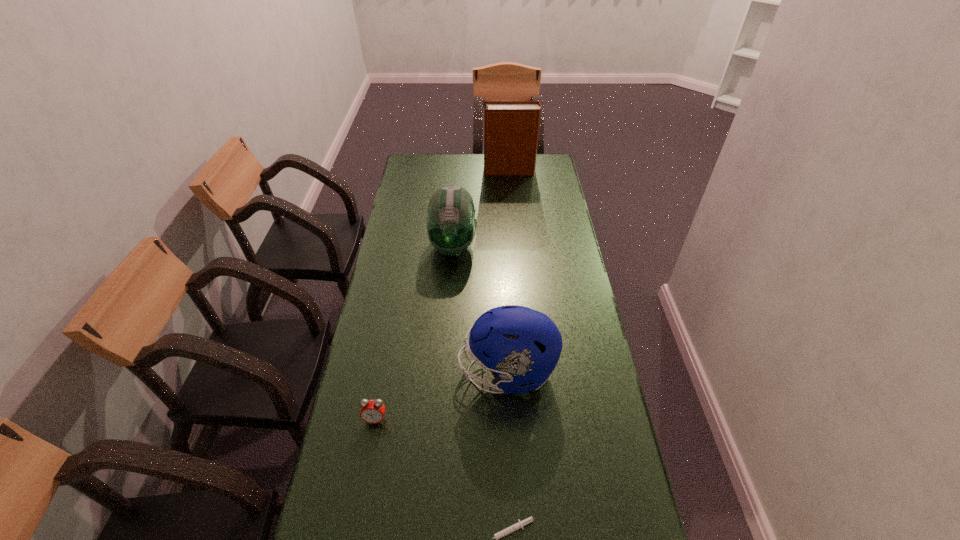
Image resolution: width=960 pixels, height=540 pixels. In the image, there is a desktop. In order to click on vacant space at the left edge in this screenshot , I will do `click(376, 312)`.

Where is `blank space at the right edge`? This screenshot has height=540, width=960. blank space at the right edge is located at coordinates (531, 195).

What are the coordinates of `free space that is in between the second farthest object and the second nearest object` in the screenshot? It's located at (414, 333).

You are a GUI agent. You are given a task and a screenshot of the screen. Output one action in this format:
    pyautogui.click(x=<x>, y=<y>)
    Task: Click on the empty space between the third farthest object and the farthest object
    
    Given the screenshot: What is the action you would take?
    pyautogui.click(x=508, y=272)

Image resolution: width=960 pixels, height=540 pixels. I want to click on free spot between the second farthest object and the alarm clock, so click(414, 333).

At what (x,y) coordinates should I click in order to perform the action: click on blank region between the farthest object and the second farthest object. Please return your answer as a coordinate pair (x, y). Looking at the image, I should click on (481, 208).

In order to click on free area in between the nearer football helmet and the hardback book in this screenshot , I will do `click(508, 272)`.

Identify which object is located as the second nearest to the shortest object. Please provide its 2D coordinates. Your answer should be formatted as a tuple, i.e. [(x, y)], where the tuple contains the x and y coordinates of a point satisfying the conditions above.

[(372, 411)]

In order to click on object that is the second closest to the shortest object in this screenshot , I will do `click(372, 411)`.

The image size is (960, 540). I want to click on free space that satisfies the following two spatial constraints: 1. on the open cover of the tallest object; 2. on the front-facing side of the second shortest object, so click(533, 419).